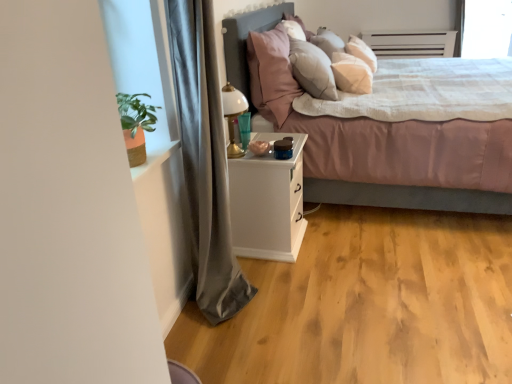
I want to click on free location in front of gray fabric curtain at left, so click(233, 342).